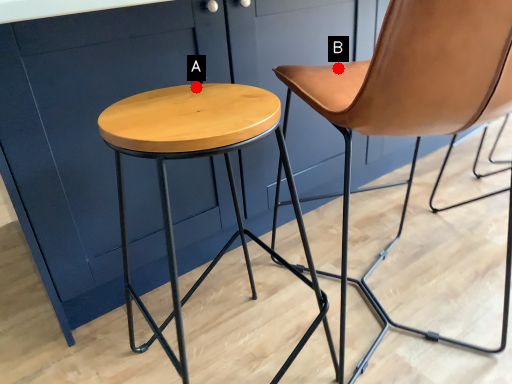
Question: Two points are circled on the image, labeled by A and B beside each circle. Which point is further to the camera?

Choices:
 (A) A is further
 (B) B is further

Answer: (B)